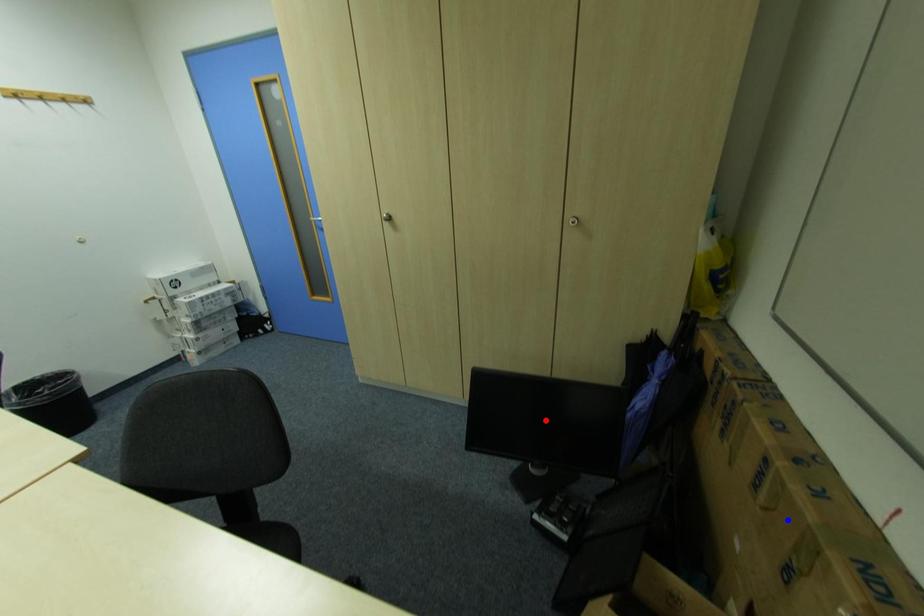
Question: In the image, two points are highlighted. Which point is nearer to the camera? Reply with the corresponding letter.

Choices:
 (A) blue point
 (B) red point

Answer: (A)